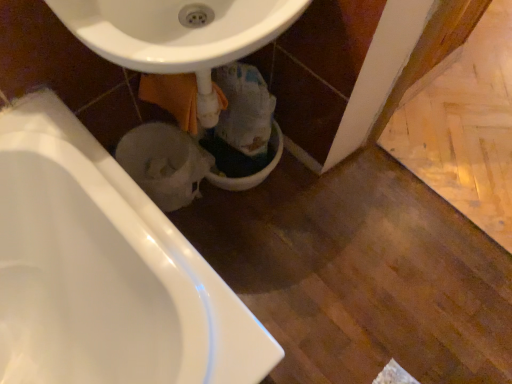
Question: Would you say white glossy bathtub at lower left contains white glossy toilet bowl at lower center, the first toilet bowl from the left?

Choices:
 (A) no
 (B) yes

Answer: (A)

Question: Considering the relative sizes of white glossy bathtub at lower left and white glossy toilet bowl at lower center, the 2th toilet bowl from the right, in the image provided, is white glossy bathtub at lower left wider than white glossy toilet bowl at lower center, the 2th toilet bowl from the right,?

Choices:
 (A) no
 (B) yes

Answer: (B)

Question: Does white glossy bathtub at lower left come behind white glossy toilet bowl at lower center, the first toilet bowl from the left?

Choices:
 (A) no
 (B) yes

Answer: (A)

Question: Is white glossy bathtub at lower left positioned in front of white glossy toilet bowl at lower center, the first toilet bowl from the left?

Choices:
 (A) yes
 (B) no

Answer: (A)

Question: Is white glossy bathtub at lower left taller than white glossy toilet bowl at lower center, the first toilet bowl from the left?

Choices:
 (A) no
 (B) yes

Answer: (B)

Question: Is white glossy toilet bowl at lower center, the first toilet bowl from the left, spatially inside white glossy sink at center, or outside of it?

Choices:
 (A) inside
 (B) outside

Answer: (B)

Question: From the image's perspective, is white glossy toilet bowl at lower center, the 2th toilet bowl from the right, above or below white glossy sink at center?

Choices:
 (A) below
 (B) above

Answer: (A)

Question: From a real-world perspective, relative to white glossy sink at center, is white glossy toilet bowl at lower center, the 2th toilet bowl from the right, vertically above or below?

Choices:
 (A) above
 (B) below

Answer: (B)

Question: Is white glossy toilet bowl at lower center, the 2th toilet bowl from the right, in front of or behind white glossy sink at center in the image?

Choices:
 (A) behind
 (B) front

Answer: (A)

Question: From their relative heights in the image, would you say white glossy toilet bowl at center, the 1th toilet bowl in the right-to-left sequence, is taller or shorter than white glossy bathtub at lower left?

Choices:
 (A) short
 (B) tall

Answer: (A)

Question: In terms of width, does white glossy toilet bowl at center, the 2th toilet bowl viewed from the left, look wider or thinner when compared to white glossy bathtub at lower left?

Choices:
 (A) thin
 (B) wide

Answer: (A)

Question: Considering the relative positions of white glossy toilet bowl at center, the 2th toilet bowl viewed from the left, and white glossy bathtub at lower left in the image provided, is white glossy toilet bowl at center, the 2th toilet bowl viewed from the left, to the left or to the right of white glossy bathtub at lower left?

Choices:
 (A) left
 (B) right

Answer: (B)

Question: From the image's perspective, is white glossy toilet bowl at center, the 2th toilet bowl viewed from the left, above or below white glossy bathtub at lower left?

Choices:
 (A) below
 (B) above

Answer: (B)

Question: Is white glossy toilet bowl at lower center, the first toilet bowl from the left, taller or shorter than white glossy bathtub at lower left?

Choices:
 (A) short
 (B) tall

Answer: (A)

Question: From the image's perspective, is white glossy toilet bowl at lower center, the 2th toilet bowl from the right, positioned above or below white glossy bathtub at lower left?

Choices:
 (A) below
 (B) above

Answer: (B)